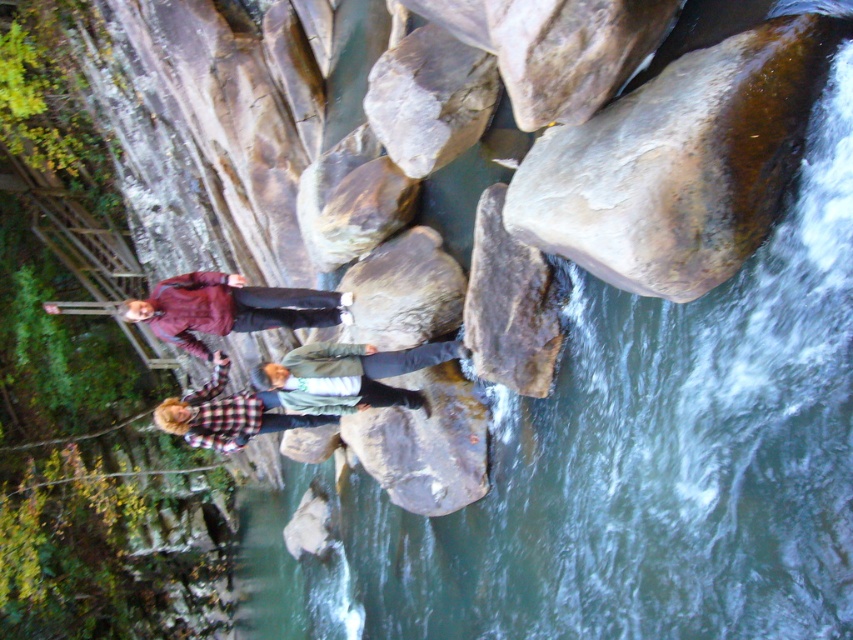
You are standing at the point labeled point (486,189) and want to walk to the point labeled point (381,298). Given that the path between them is along the rocks, which direction should you move relative to your current position?

You should move forward because point (486,189) is closer to the viewer than point (381,298), so moving towards the latter requires going away from the viewer.

In the scene shown: You are standing at the point marked by the coordinates point (508,305). Based on the scene described, what type of rock are you likely standing on?

→ The point (508,305) indicates a smooth brown rock at center, so you are likely standing on a smooth brown rock.